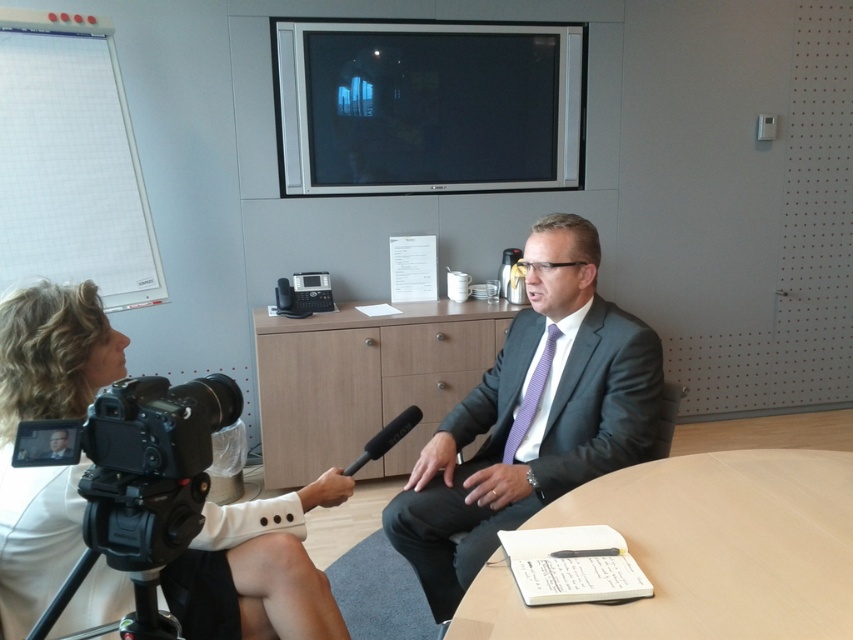
Is black plastic video camera at lower left to the right of black plastic tripod at lower left from the viewer's perspective?

Yes, black plastic video camera at lower left is to the right of black plastic tripod at lower left.

How far apart are black plastic video camera at lower left and black plastic tripod at lower left?

9.81 centimeters

Is point (207, 433) positioned in front of point (82, 572)?

Yes, point (207, 433) is closer to viewer.

In order to click on black plastic video camera at lower left in this screenshot , I will do `click(149, 465)`.

Is light brown wooden round table at center wider than white fabric camera at lower left?

Correct, the width of light brown wooden round table at center exceeds that of white fabric camera at lower left.

Can you confirm if light brown wooden round table at center is positioned to the right of white fabric camera at lower left?

Indeed, light brown wooden round table at center is positioned on the right side of white fabric camera at lower left.

Find the location of `light brown wooden round table at center`. light brown wooden round table at center is located at coordinates (700, 552).

Who is lower down, wooden table at center or black plastic tripod at lower left?

Positioned lower is black plastic tripod at lower left.

Can you confirm if wooden table at center is taller than black plastic tripod at lower left?

Correct, wooden table at center is much taller as black plastic tripod at lower left.

Which is behind, point (486, 312) or point (160, 627)?

The point (486, 312) is more distant.

Locate an element on the screen. wooden table at center is located at coordinates (364, 380).